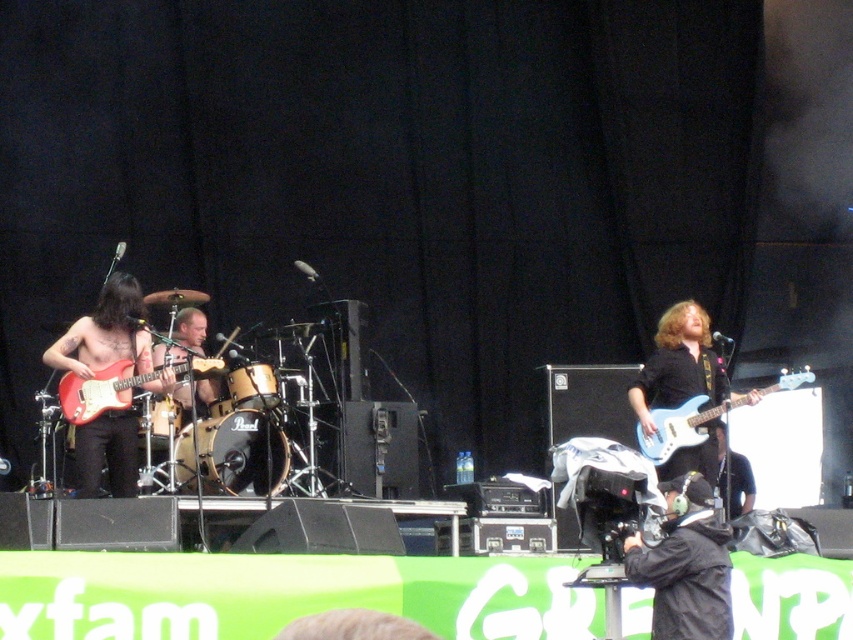
Measure the distance between blue glossy electric guitar at center and camera.

blue glossy electric guitar at center and camera are 72.27 feet apart.

This screenshot has width=853, height=640. Describe the element at coordinates (677, 364) in the screenshot. I see `blue glossy electric guitar at center` at that location.

Identify the location of blue glossy electric guitar at center. This screenshot has width=853, height=640. (677, 364).

Can you confirm if matte black guitar at left is thinner than blue glossy electric guitar at center?

Yes, matte black guitar at left is thinner than blue glossy electric guitar at center.

Is point (96, 314) closer to camera compared to point (689, 456)?

Yes.

Identify the location of matte black guitar at left. The image size is (853, 640). (105, 332).

Is point (93, 380) positioned before point (680, 428)?

Yes, point (93, 380) is in front of point (680, 428).

Is matte red electric guitar at left below matte blue electric guitar at right?

No.

Between point (102, 401) and point (813, 376), which one is positioned in front?

Point (102, 401) is more forward.

Locate an element on the screen. matte red electric guitar at left is located at coordinates (120, 385).